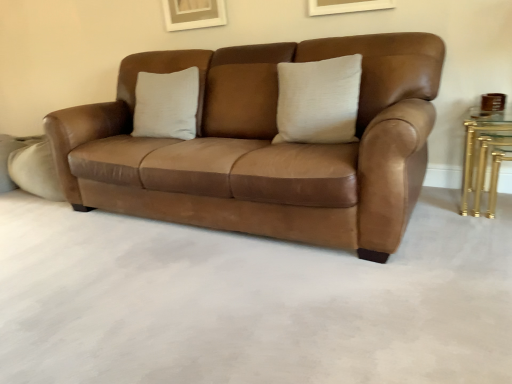
Question: Is point (409, 145) closer or farther from the camera than point (348, 69)?

Choices:
 (A) farther
 (B) closer

Answer: (B)

Question: Based on their sizes in the image, would you say suede leather couch at center is bigger or smaller than satin beige pillow at center?

Choices:
 (A) big
 (B) small

Answer: (A)

Question: Estimate the real-world distances between objects in this image. Which object is closer to the gold metallic table at right?

Choices:
 (A) satin beige pillow at center
 (B) suede leather couch at center

Answer: (A)

Question: Which of these objects is positioned closest to the gold metallic table at right?

Choices:
 (A) suede leather couch at center
 (B) satin beige pillow at center

Answer: (B)